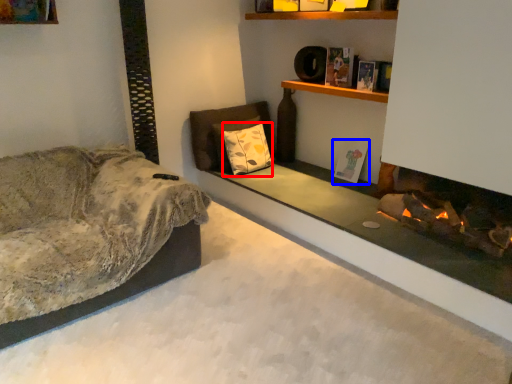
Question: Which object appears closest to the camera in this image, pillow (highlighted by a red box) or book (highlighted by a blue box)?

Choices:
 (A) pillow
 (B) book

Answer: (B)